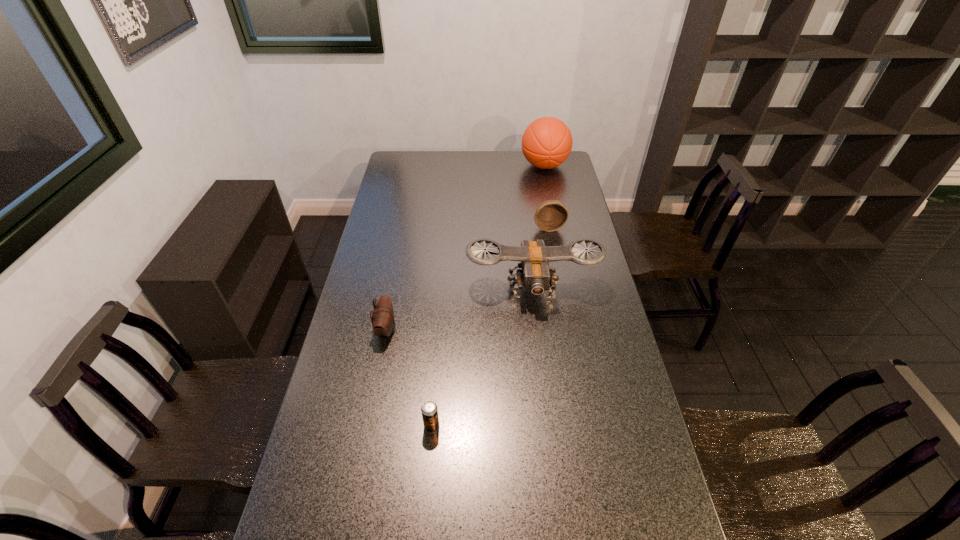
Locate an element on the screen. blank area located 0.320m on the front of the tallest object is located at coordinates (555, 218).

In order to click on vacant space located on the front-facing side of the drone in this screenshot , I will do `click(540, 351)`.

Locate an element on the screen. The image size is (960, 540). vacant region located on the front of the third shortest object is located at coordinates (555, 257).

Identify the location of free space located 0.060m with the flap open on the leftmost object. The image size is (960, 540). (415, 329).

Locate an element on the screen. The image size is (960, 540). vacant space located 0.070m on the front of the second object from left to right is located at coordinates (429, 458).

What are the coordinates of `object that is at the far edge` in the screenshot? It's located at (547, 142).

Locate an element on the screen. The height and width of the screenshot is (540, 960). object at the left edge is located at coordinates (383, 320).

Where is `basketball present at the right edge`? The height and width of the screenshot is (540, 960). basketball present at the right edge is located at coordinates (547, 142).

Locate an element on the screen. The width and height of the screenshot is (960, 540). drone present at the right edge is located at coordinates point(535,275).

Locate an element on the screen. bowl present at the right edge is located at coordinates (551, 215).